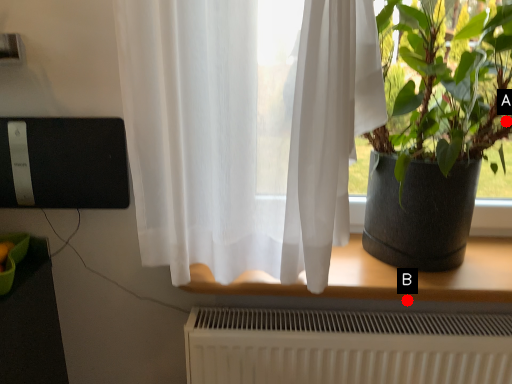
Question: Two points are circled on the image, labeled by A and B beside each circle. Which point appears farthest from the camera in this image?

Choices:
 (A) A is further
 (B) B is further

Answer: (B)